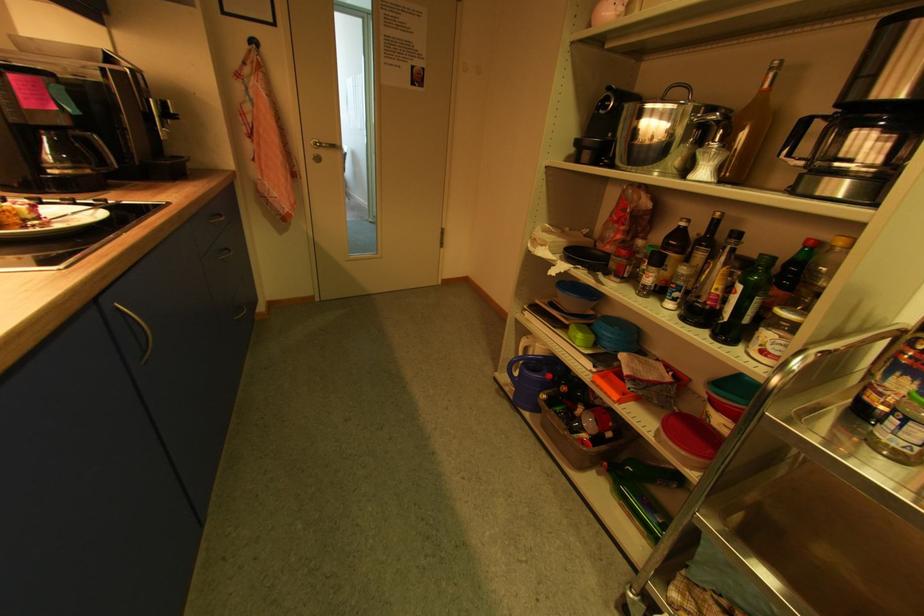
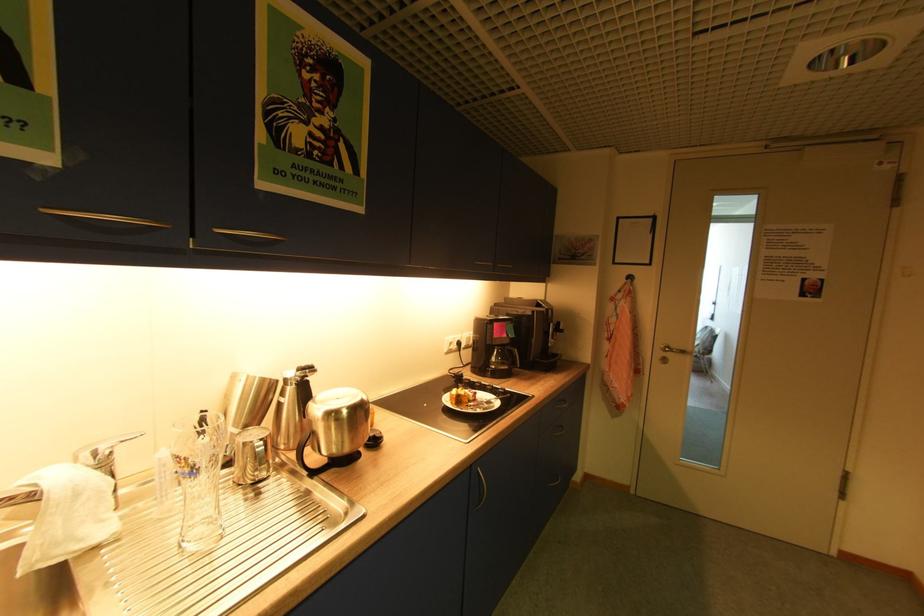
Question: How did the camera likely rotate?

Choices:
 (A) Left
 (B) Right
 (C) Up
 (D) Down

Answer: (A)